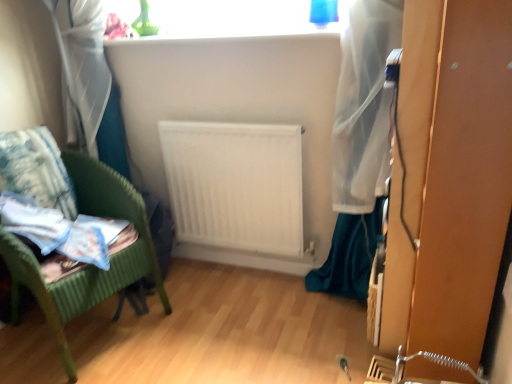
Question: Considering the positions of fluffy white pillow at left and white matte radiator at center in the image, is fluffy white pillow at left wider or thinner than white matte radiator at center?

Choices:
 (A) thin
 (B) wide

Answer: (B)

Question: From the image's perspective, is fluffy white pillow at left above or below white matte radiator at center?

Choices:
 (A) below
 (B) above

Answer: (B)

Question: Which object is the closest to the white matte radiator at center?

Choices:
 (A) fluffy white pillow at left
 (B) green wicker chair at left

Answer: (B)

Question: Based on their relative distances, which object is farther from the white matte radiator at center?

Choices:
 (A) green wicker chair at left
 (B) fluffy white pillow at left

Answer: (B)